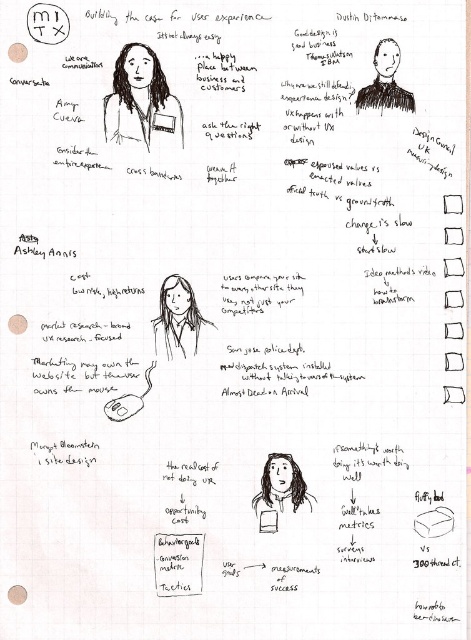
Based on the photo, you are standing 5 feet away from the image. Is the point at coordinates point [170,326] closer to you than 4 feet?

The distance of point [170,326] from viewer is 3.67 feet, so yes, the point at coordinates point [170,326] is closer to you than 4 feet since 3.67 feet is less than 4 feet.

You are an UX designer attending a meeting and need to present your notes. You have two items on your desk, the white paper at center and the matte white notepad at upper center. Which item is taller?

The white paper at center is much taller than the matte white notepad at upper center.

You are a UX designer attending a meeting and see the image. You need to present your ideas. Which object is closer to the center of the page, the matte black shirt at center or the matte white notepad at upper center?

The matte black shirt at center is closer to the center of the page than the matte white notepad at upper center.